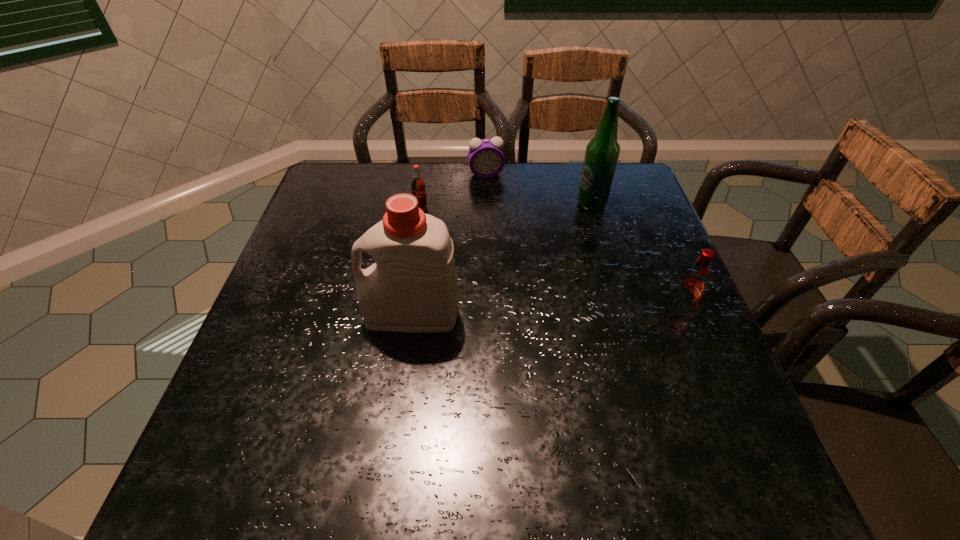
Image resolution: width=960 pixels, height=540 pixels. What are the coordinates of `alarm clock that is at the far edge` in the screenshot? It's located at (486, 159).

The height and width of the screenshot is (540, 960). Identify the location of root beer present at the right edge. (693, 284).

The width and height of the screenshot is (960, 540). What are the coordinates of `beer bottle positioned at the right edge` in the screenshot? It's located at (602, 152).

Find the location of a particular element. Image resolution: width=960 pixels, height=540 pixels. object that is at the far right corner is located at coordinates click(x=602, y=152).

The image size is (960, 540). What are the coordinates of `free space at the far edge` in the screenshot? It's located at (430, 205).

This screenshot has width=960, height=540. In order to click on vacant region at the near edge of the desktop in this screenshot , I will do `click(573, 415)`.

Where is `vacant area at the left edge of the desktop`? vacant area at the left edge of the desktop is located at coordinates (235, 388).

The height and width of the screenshot is (540, 960). Identify the location of vacant space at the right edge of the desktop. (628, 239).

The image size is (960, 540). What are the coordinates of `free space between the rightmost object and the farthest object` in the screenshot? It's located at [x=583, y=244].

Identify the location of free space between the second object from right to left and the root beer. This screenshot has height=540, width=960. (636, 258).